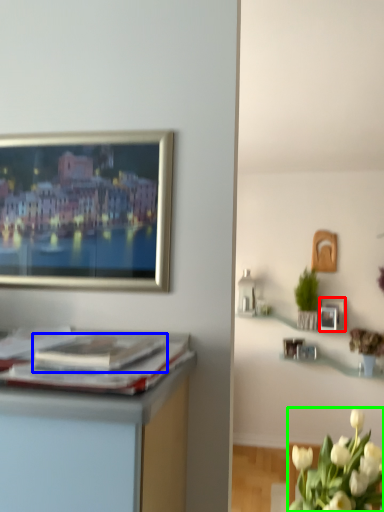
Question: Which object is positioned closest to picture frame (highlighted by a red box)? Select from magazine (highlighted by a blue box) and flower (highlighted by a green box).

Choices:
 (A) magazine
 (B) flower

Answer: (B)